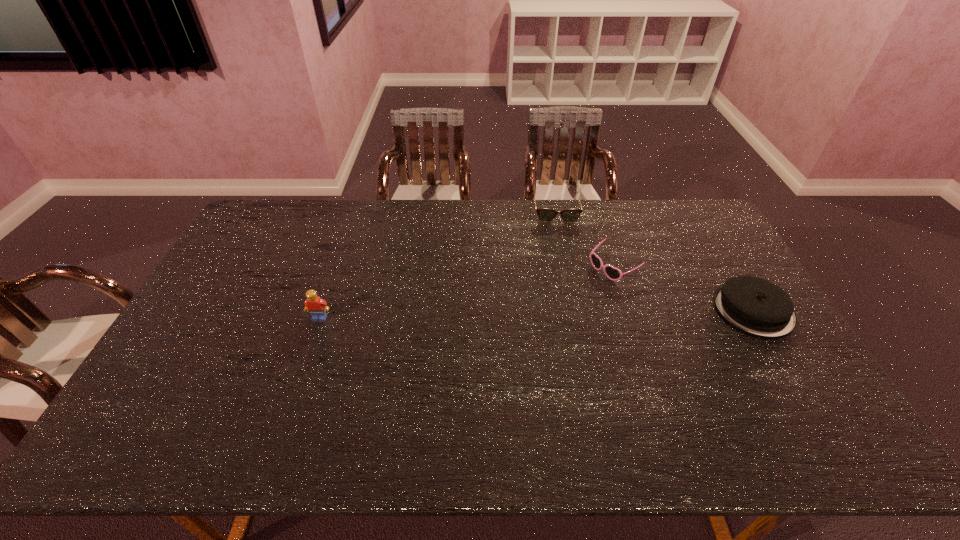
Where is `vacant spot on the desktop that is between the tallest object and the pancake and is positioned on the front-facing side of the sunglasses`? The image size is (960, 540). vacant spot on the desktop that is between the tallest object and the pancake and is positioned on the front-facing side of the sunglasses is located at coordinates (540, 314).

Where is `vacant space on the desktop that is between the tallest object and the pancake and is positioned at the front view of the farthest object`? The image size is (960, 540). vacant space on the desktop that is between the tallest object and the pancake and is positioned at the front view of the farthest object is located at coordinates (571, 313).